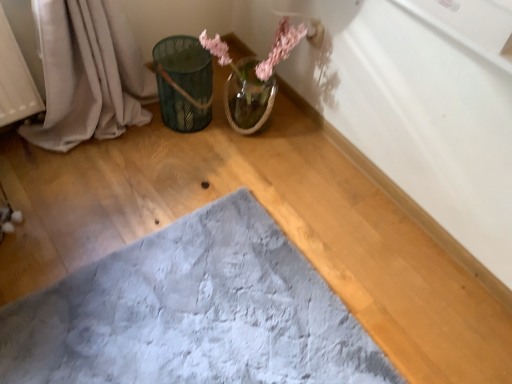
I want to click on vacant point to the right of translucent glass vase at upper center, so click(303, 146).